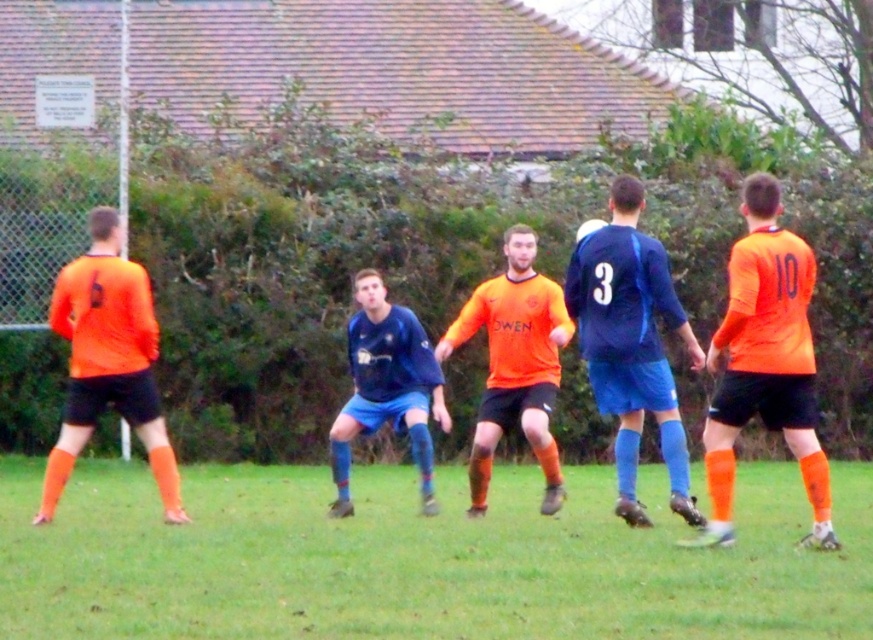
Question: Which point is farther from the camera taking this photo?

Choices:
 (A) (786, 349)
 (B) (416, 416)

Answer: (B)

Question: Is orange matte jersey at right above orange matte jersey at center?

Choices:
 (A) yes
 (B) no

Answer: (A)

Question: Which object is positioned farthest from the blue matte jersey at center?

Choices:
 (A) matte orange jersey at left
 (B) matte orange jersey at center
 (C) green grass at center

Answer: (A)

Question: Is matte orange jersey at left closer to camera compared to blue jersey at center?

Choices:
 (A) yes
 (B) no

Answer: (A)

Question: Estimate the real-world distances between objects in this image. Which object is closer to the blue jersey at center?

Choices:
 (A) orange matte jersey at right
 (B) blue matte jersey at center
 (C) matte orange jersey at left

Answer: (B)

Question: Is orange matte jersey at right wider than orange matte jersey at center?

Choices:
 (A) no
 (B) yes

Answer: (A)